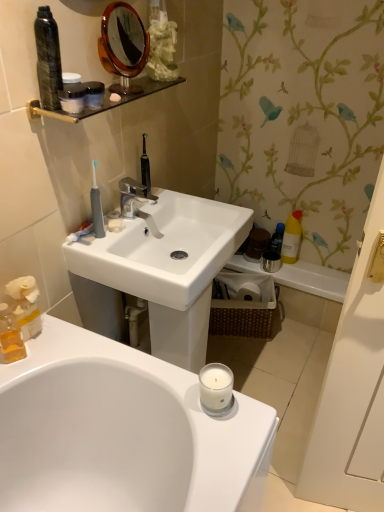
Find the location of a particular element. This screenshot has height=512, width=384. vacant area that lies in front of yellow matte bottle at right, which is the fifth mouthwash in left-to-right order is located at coordinates 309,274.